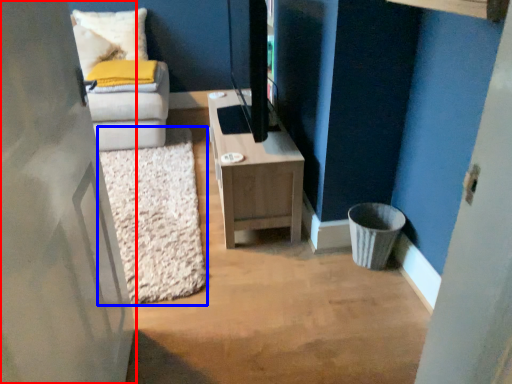
Question: Which object is closer to the camera taking this photo, door (highlighted by a red box) or mat (highlighted by a blue box)?

Choices:
 (A) door
 (B) mat

Answer: (A)